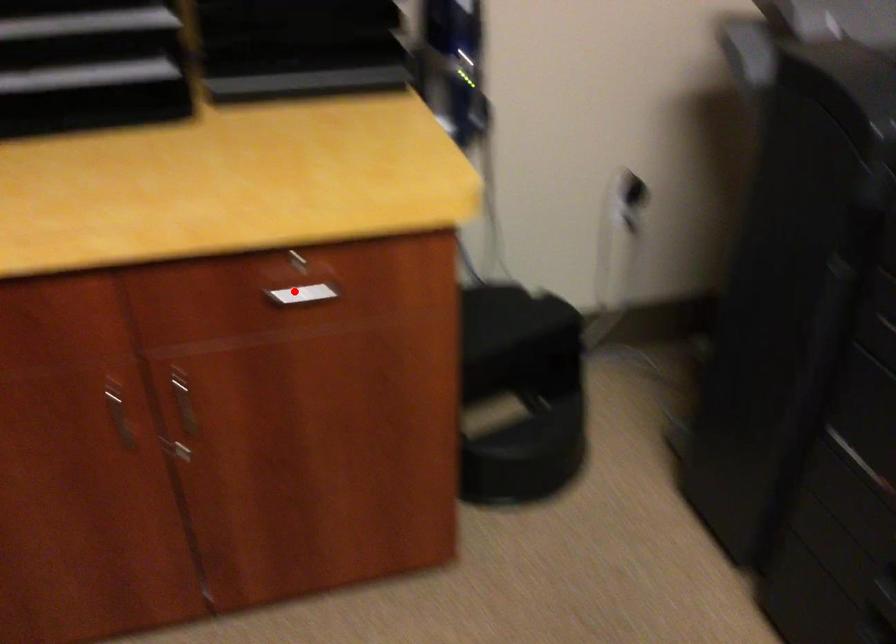
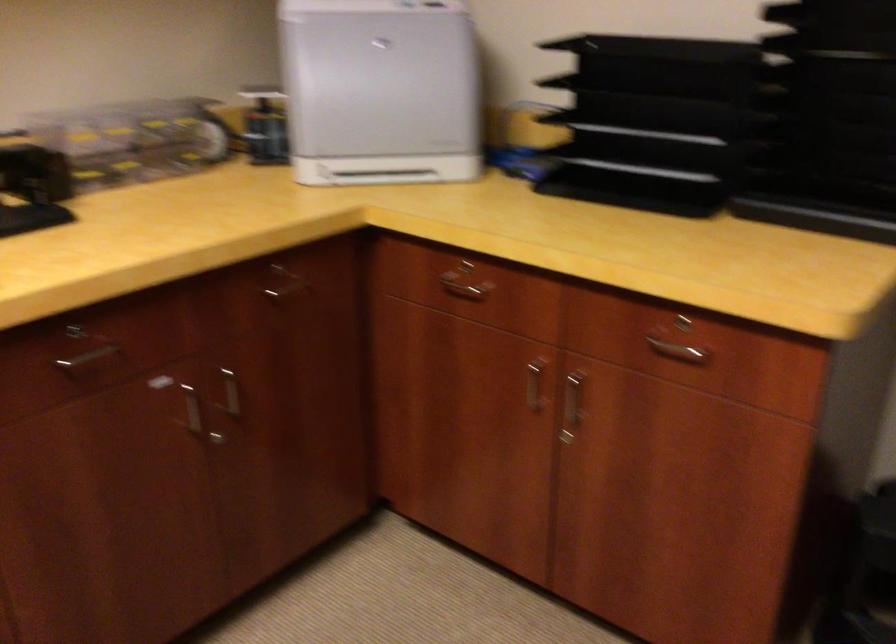
Where in the second image is the point corresponding to the highlighted location from the first image?

(677, 351)